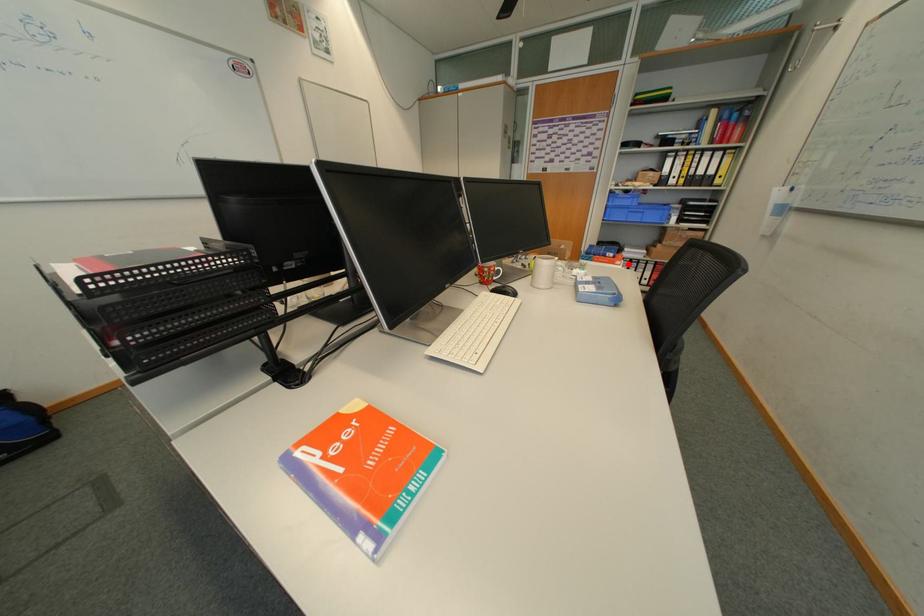
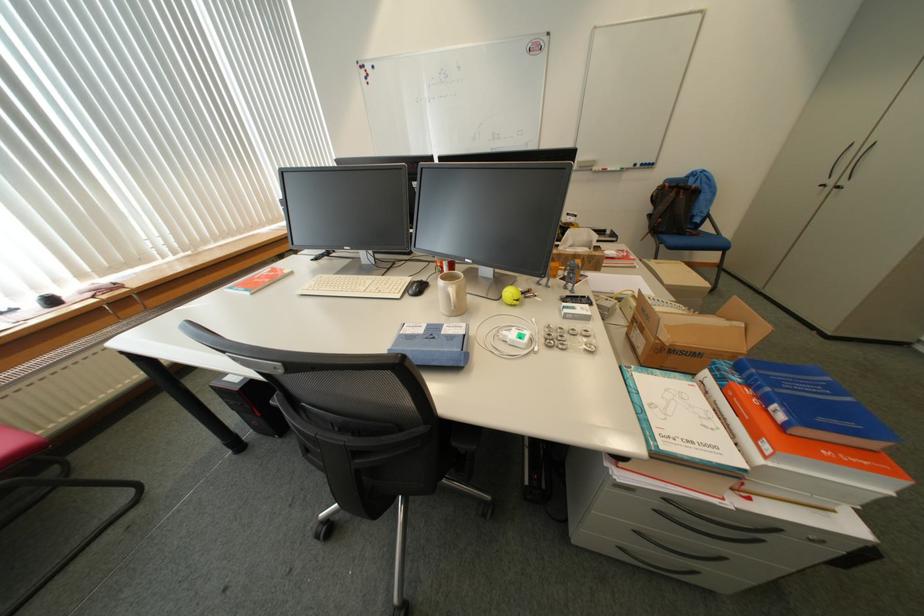
Where in the second image is the point corresponding to the highlighted location from the first image?

(775, 448)